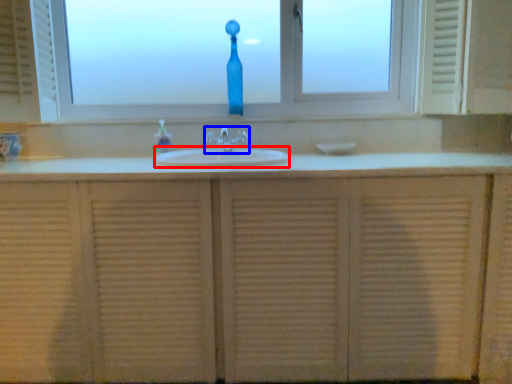
Question: Which of the following is the closest to the observer, sink (highlighted by a red box) or tap (highlighted by a blue box)?

Choices:
 (A) sink
 (B) tap

Answer: (A)